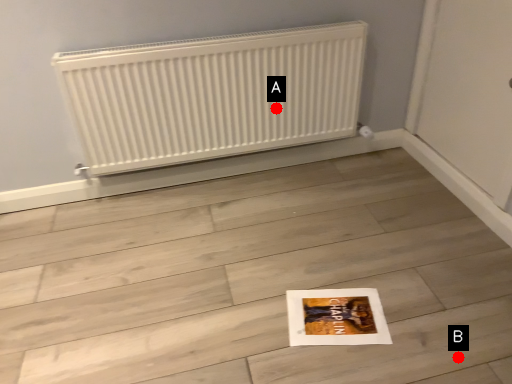
Question: Two points are circled on the image, labeled by A and B beside each circle. Which of the following is the closest to the observer?

Choices:
 (A) A is closer
 (B) B is closer

Answer: (B)